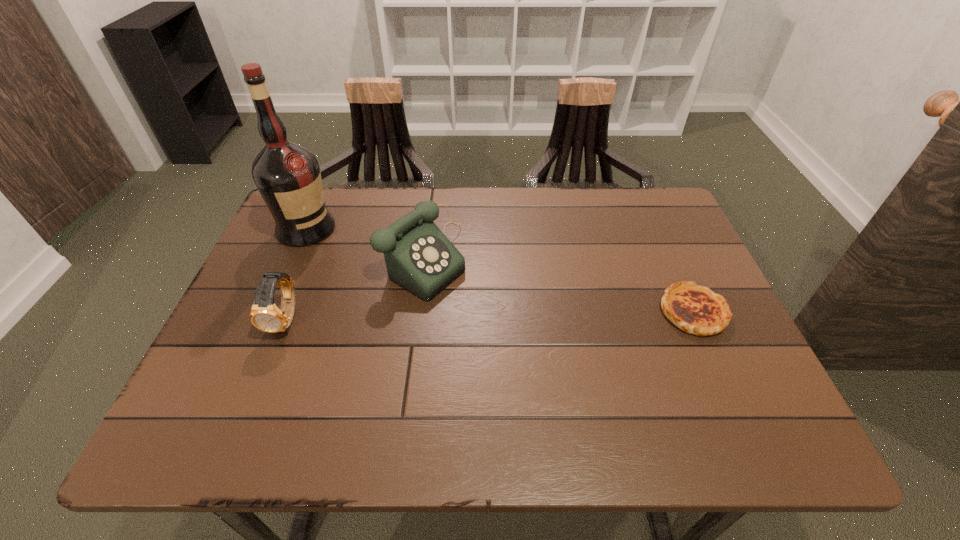
Locate an element on the screen. Image resolution: width=960 pixels, height=540 pixels. free space between the second tallest object and the quiche is located at coordinates (559, 285).

Where is `unoccupied position between the third tallest object and the shortest object`? The height and width of the screenshot is (540, 960). unoccupied position between the third tallest object and the shortest object is located at coordinates (490, 315).

The image size is (960, 540). I want to click on vacant space in between the watch and the liquor, so click(297, 274).

The image size is (960, 540). Identify the location of vacant area that lies between the tallest object and the quiche. (499, 270).

This screenshot has width=960, height=540. What are the coordinates of `free space between the quiche and the tallest object` in the screenshot? It's located at (499, 270).

Locate an element on the screen. vacant area between the second object from right to left and the watch is located at coordinates (356, 289).

You are a GUI agent. You are given a task and a screenshot of the screen. Output one action in this format:
    pyautogui.click(x=<x>, y=<y>)
    Task: Click on the free area in between the second tallest object and the watch
    The image size is (960, 540).
    Given the screenshot: What is the action you would take?
    pyautogui.click(x=356, y=289)

Where is `object that is the closest to the rightmost object`? The height and width of the screenshot is (540, 960). object that is the closest to the rightmost object is located at coordinates (418, 256).

Identify which object is the second closest to the tallest object. Please provide its 2D coordinates. Your answer should be formatted as a tuple, i.e. [(x, y)], where the tuple contains the x and y coordinates of a point satisfying the conditions above.

[(265, 315)]

Image resolution: width=960 pixels, height=540 pixels. In order to click on free space that satisfies the following two spatial constraints: 1. on the front side of the tallest object; 2. on the left side of the quiche in this screenshot , I will do `click(270, 312)`.